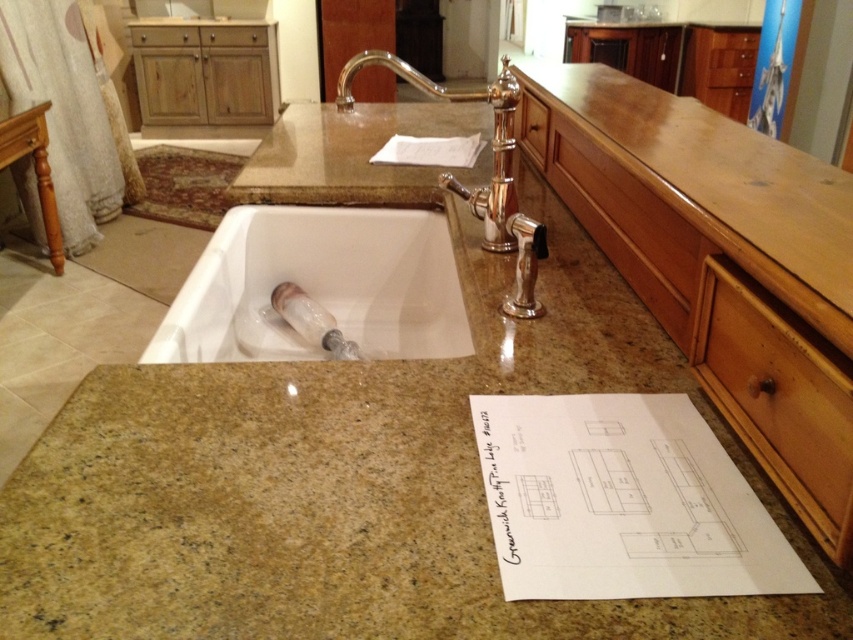
Does white paper at center have a lesser height compared to brown wood drawer at lower right?

Indeed, white paper at center has a lesser height compared to brown wood drawer at lower right.

Can you confirm if white paper at center is positioned to the right of brown wood drawer at lower right?

Incorrect, white paper at center is not on the right side of brown wood drawer at lower right.

Between point (474, 406) and point (751, 396), which one is positioned in front?

Point (751, 396) is in front.

At what (x,y) coordinates should I click in order to perform the action: click on white paper at center. Please return your answer as a coordinate pair (x, y). This screenshot has height=640, width=853. Looking at the image, I should click on (622, 500).

Between white glossy sink at center and wooden drawer at center, which one has less height?

white glossy sink at center is shorter.

Between point (254, 328) and point (677, 260), which one is positioned behind?

The point (254, 328) is behind.

Does point (331, 310) come in front of point (669, 257)?

No, (331, 310) is further to viewer.

Where is `white glossy sink at center`? white glossy sink at center is located at coordinates (318, 285).

Is brown wood drawer at lower right behind wooden drawer at upper left?

No, brown wood drawer at lower right is closer to the viewer.

Describe the element at coordinates (779, 397) in the screenshot. I see `brown wood drawer at lower right` at that location.

Which is behind, point (766, 428) or point (155, 44)?

Point (155, 44)

Locate an element on the screen. Image resolution: width=853 pixels, height=640 pixels. brown wood drawer at lower right is located at coordinates (779, 397).